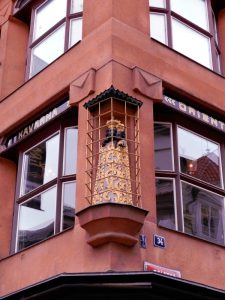
Locate an element on the screen. wall brownish red top floor is located at coordinates (5, 7), (17, 45), (123, 8), (91, 8).